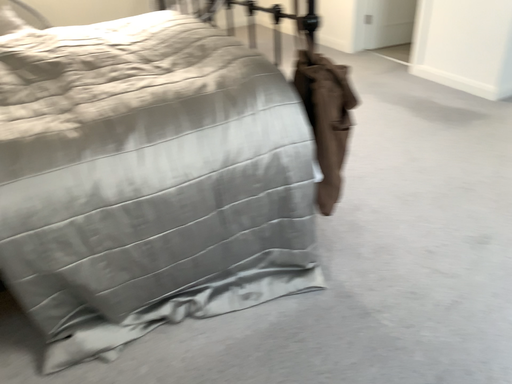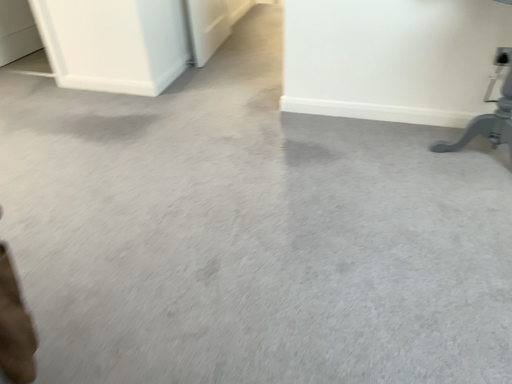
Question: How did the camera likely rotate when shooting the video?

Choices:
 (A) rotated downward
 (B) rotated upward

Answer: (B)